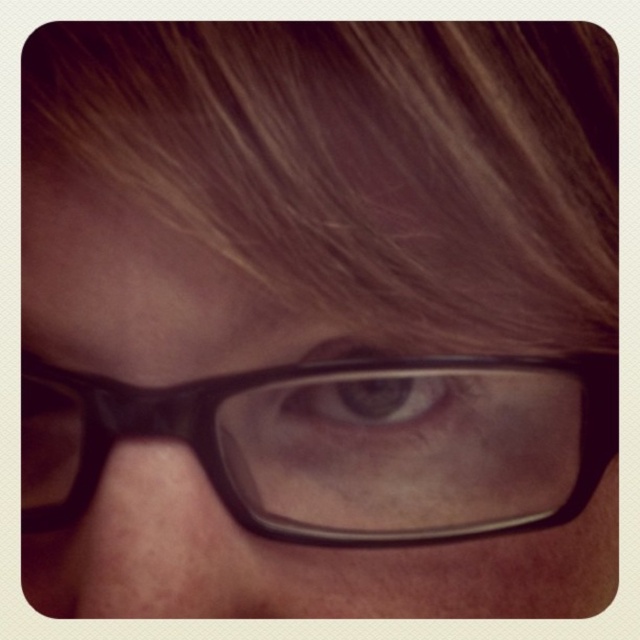
You are a photographer adjusting the focus on your camera. You notice two pairs of glasses in the frame. The first is the black matte glasses at center, and the second is the matte black glasses at lower center. Which pair of glasses should you focus on if you want to capture the larger one clearly?

The black matte glasses at center is larger in size compared to the matte black glasses at lower center, so you should focus on the black matte glasses at center to capture it clearly.

You are a photographer adjusting the focus of your camera. You notice the brown smooth hair at upper center and the matte black eye at center in your frame. Which object should you focus on first if you want to ensure the closest subject is sharp?

The brown smooth hair at upper center is closer to the viewer than the matte black eye at center, so you should focus on the brown smooth hair at upper center first to ensure the closest subject is sharp.

You are a photographer adjusting the focus on your camera. You notice the black plastic glasses at center and the matte black eye at center in your frame. Which object is wider in the image?

The black plastic glasses at center is wider than the matte black eye at center according to the description.